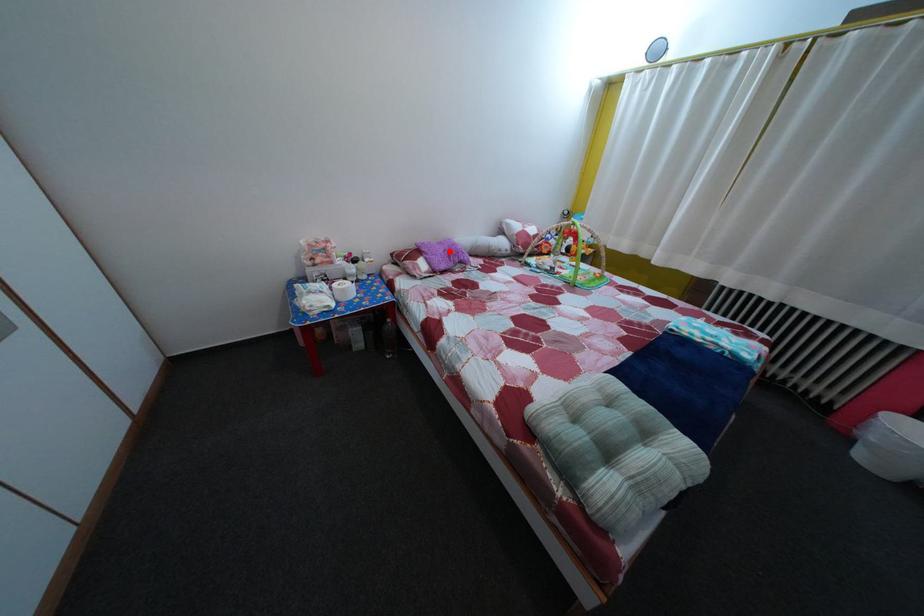
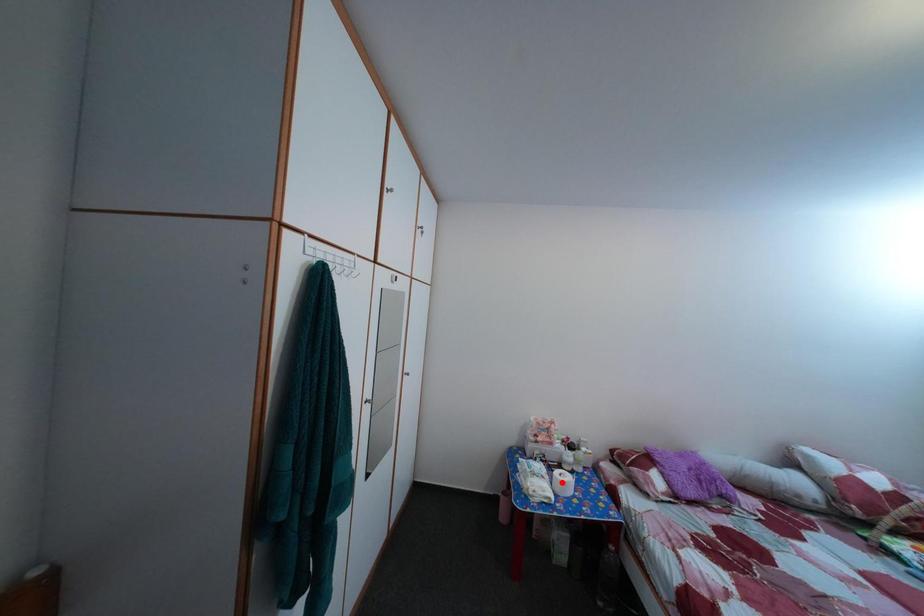
I am providing you with two images of the same scene from different viewpoints. A red point is marked on the first image and another point is marked on the second image. Is the red point in image1 aligned with the point shown in image2?

No